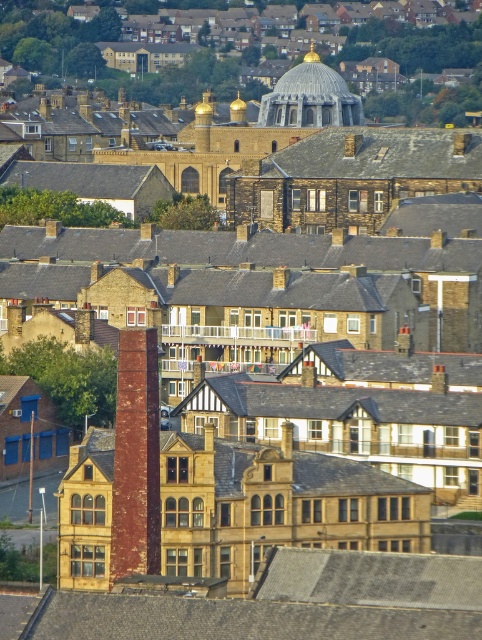
The width and height of the screenshot is (482, 640). What do you see at coordinates (135, 458) in the screenshot?
I see `red brick chimney at center` at bounding box center [135, 458].

Is red brick chimney at center further to the viewer compared to silver metallic dome at center?

No.

Which is in front, point (133, 492) or point (343, 122)?

Point (133, 492) is more forward.

The width and height of the screenshot is (482, 640). I want to click on red brick chimney at center, so click(135, 458).